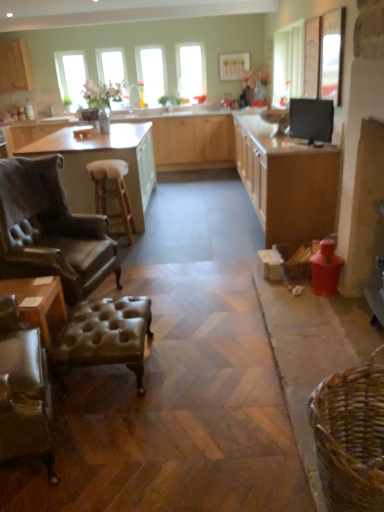
Where is `free space above wooden table at lower left, positioned as the second table in top-to-bottom order (from a real-world perspective)`? This screenshot has width=384, height=512. free space above wooden table at lower left, positioned as the second table in top-to-bottom order (from a real-world perspective) is located at coordinates (29, 285).